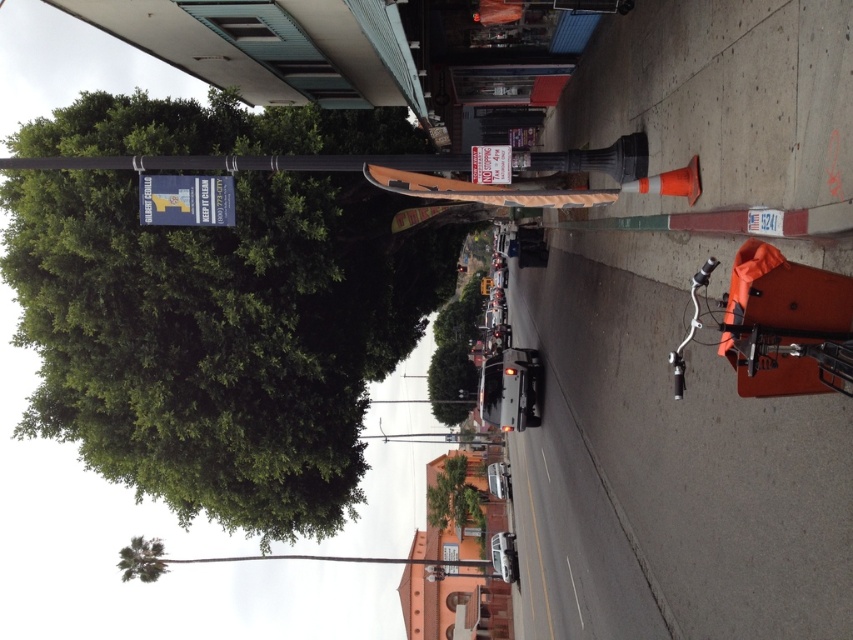
Question: Which point is farther from the camera taking this photo?

Choices:
 (A) (428, 496)
 (B) (138, 566)
 (C) (97, 458)

Answer: (A)

Question: Does green leafy tree at center come behind green leafy tree at lower left?

Choices:
 (A) yes
 (B) no

Answer: (A)

Question: Is green leafy tree at upper left bigger than green leafy tree at lower left?

Choices:
 (A) no
 (B) yes

Answer: (A)

Question: Which point is farther to the camera?

Choices:
 (A) (437, 528)
 (B) (160, 547)

Answer: (A)

Question: Which point is farther to the camera?

Choices:
 (A) green leafy tree at center
 (B) green leafy tree at upper left

Answer: (A)

Question: Observing the image, what is the correct spatial positioning of green leafy tree at center in reference to green leafy tree at lower left?

Choices:
 (A) below
 (B) above

Answer: (B)